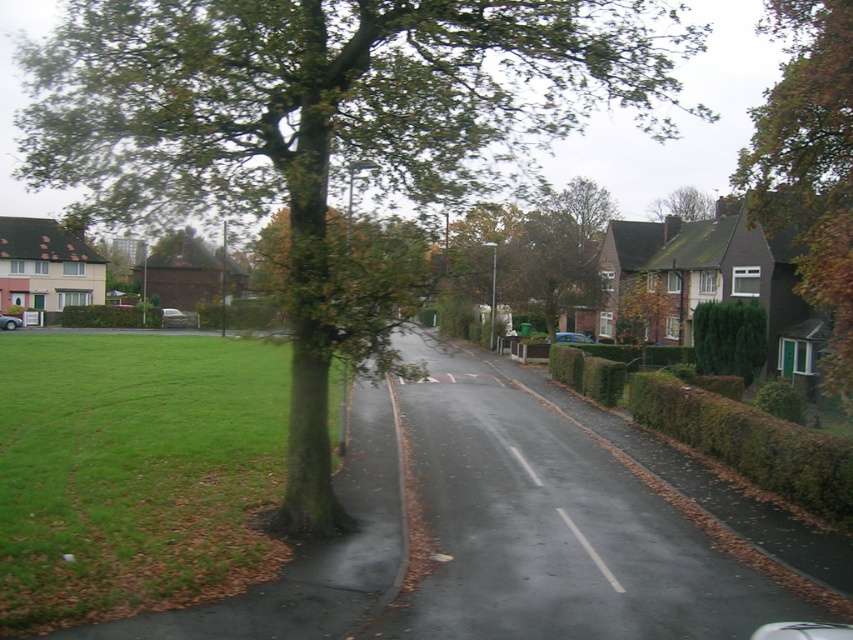
Question: Which of the following is the farthest from the observer?

Choices:
 (A) (575, 339)
 (B) (9, 326)
 (C) (171, 314)
 (D) (604, 189)

Answer: (D)

Question: Can you confirm if brown leafy tree at upper right is positioned to the left of green leafy tree at upper center?

Choices:
 (A) yes
 (B) no

Answer: (B)

Question: Is brown textured tree at center below blue metallic car at center?

Choices:
 (A) yes
 (B) no

Answer: (B)

Question: Observing the image, what is the correct spatial positioning of brown leafy tree at upper right in reference to blue metallic car at center?

Choices:
 (A) right
 (B) left

Answer: (A)

Question: Which point is closer to the camera?

Choices:
 (A) (161, 310)
 (B) (10, 323)

Answer: (B)

Question: Which object is the farthest from the brown textured tree at upper center?

Choices:
 (A) metallic silver car at center
 (B) brown textured tree at center

Answer: (A)